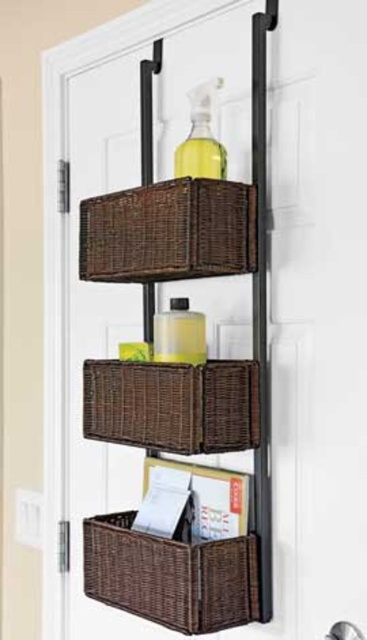
Consider the image. Is brown wicker baskets at center thinner than woven brown basket at lower center?

Incorrect, brown wicker baskets at center's width is not less than woven brown basket at lower center's.

Where is `brown wicker baskets at center`? The image size is (367, 640). brown wicker baskets at center is located at coordinates [x=151, y=317].

Locate an element on the screen. The height and width of the screenshot is (640, 367). brown wicker baskets at center is located at coordinates (151, 317).

This screenshot has height=640, width=367. I want to click on brown wicker baskets at center, so click(151, 317).

Does brown wicker baskets at center have a greater width compared to woven brown basket at center?

Indeed, brown wicker baskets at center has a greater width compared to woven brown basket at center.

Which is behind, point (99, 593) or point (201, 365)?

The point (99, 593) is behind.

This screenshot has width=367, height=640. Find the location of `brown wicker baskets at center`. brown wicker baskets at center is located at coordinates (151, 317).

Can you confirm if brown wicker basket at center is positioned to the right of woven brown basket at lower center?

In fact, brown wicker basket at center is to the left of woven brown basket at lower center.

Between point (100, 198) and point (85, 564), which one is positioned in front?

Point (100, 198)

The width and height of the screenshot is (367, 640). Find the location of `brown wicker basket at center`. brown wicker basket at center is located at coordinates (168, 230).